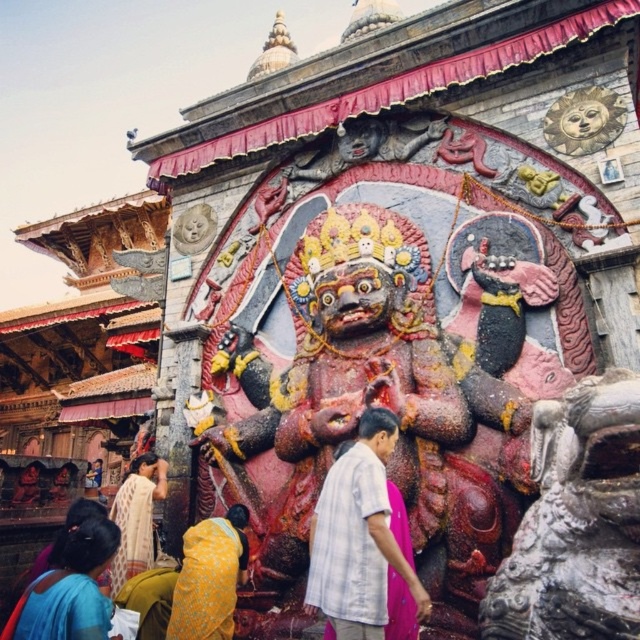
You are a visitor at the temple and want to take a photo of the deity statue. You notice a white cotton shirt at center and a yellow fabric at lower left in your view. Which object should you avoid blocking to ensure the statue is fully visible in your photo?

You should avoid blocking the white cotton shirt at center because it is positioned to the right of the yellow fabric at lower left, so blocking it might obstruct the view of the statue.